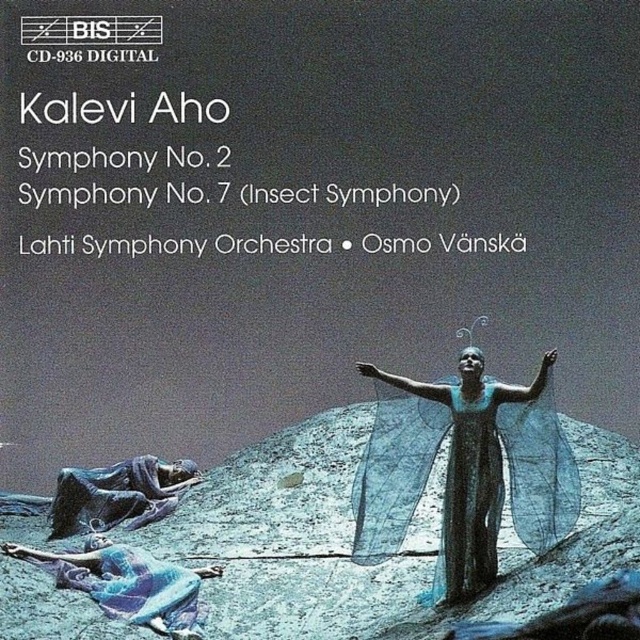
Question: Which of the following is the closest to the observer?

Choices:
 (A) (176, 572)
 (B) (540, 465)

Answer: (B)

Question: Is blue fabric at lower left in front of matte black figure at lower left?

Choices:
 (A) yes
 (B) no

Answer: (A)

Question: Can you confirm if translucent blue gown at center is positioned below matte black figure at lower left?

Choices:
 (A) yes
 (B) no

Answer: (B)

Question: Considering the relative positions of translucent blue gown at center and matte black figure at lower left in the image provided, where is translucent blue gown at center located with respect to matte black figure at lower left?

Choices:
 (A) above
 (B) below

Answer: (A)

Question: Among these objects, which one is nearest to the camera?

Choices:
 (A) blue fabric at lower left
 (B) matte black figure at lower left
 (C) translucent blue gown at center

Answer: (A)

Question: Which point appears farthest from the camera in this image?

Choices:
 (A) (131, 524)
 (B) (112, 604)
 (C) (374, 516)

Answer: (A)